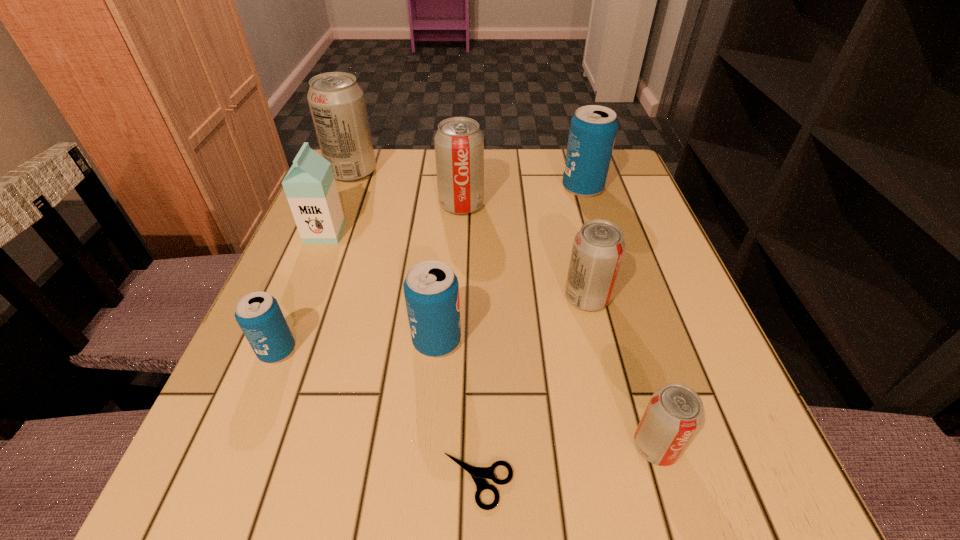
Locate an element on the screen. This screenshot has width=960, height=540. free space between the shortest object and the leftmost blue soda can is located at coordinates (377, 416).

At what (x,y) coordinates should I click in order to perform the action: click on empty space that is in between the second nearest gray soda can and the shortest object. Please return your answer as a coordinate pair (x, y). Looking at the image, I should click on (532, 390).

Locate an element on the screen. The image size is (960, 540). vacant area that lies between the nearest gray soda can and the white milk carton is located at coordinates (491, 339).

Locate which object is the third closest to the farthest gray soda can. Please provide its 2D coordinates. Your answer should be formatted as a tuple, i.e. [(x, y)], where the tuple contains the x and y coordinates of a point satisfying the conditions above.

[(593, 128)]

You are a GUI agent. You are given a task and a screenshot of the screen. Output one action in this format:
    pyautogui.click(x=<x>, y=<y>)
    Task: Click on the object that stands as the fifth closest to the white milk carton
    This screenshot has width=960, height=540.
    Given the screenshot: What is the action you would take?
    pyautogui.click(x=598, y=248)

Identify which soda can is the fifth nearest to the leftmost blue soda can. Please provide its 2D coordinates. Your answer should be formatted as a tuple, i.e. [(x, y)], where the tuple contains the x and y coordinates of a point satisfying the conditions above.

[(674, 413)]

Point out which soda can is positioned as the second nearest to the third farthest gray soda can. Please provide its 2D coordinates. Your answer should be formatted as a tuple, i.e. [(x, y)], where the tuple contains the x and y coordinates of a point satisfying the conditions above.

[(674, 413)]

Choose which gray soda can is the third nearest neighbor to the nearest gray soda can. Please provide its 2D coordinates. Your answer should be formatted as a tuple, i.e. [(x, y)], where the tuple contains the x and y coordinates of a point satisfying the conditions above.

[(337, 103)]

Identify the location of gray soda can that can be found as the closest to the third smallest gray soda can. (337, 103).

The width and height of the screenshot is (960, 540). I want to click on the closest blue soda can to the second blue soda can from left to right, so click(x=258, y=314).